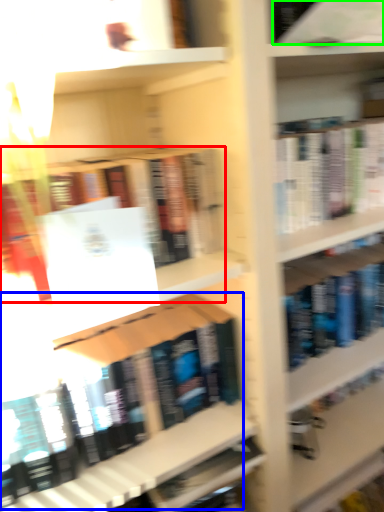
Question: Which object is the farthest from book (highlighted by a red box)? Choose among these: book (highlighted by a blue box) or book (highlighted by a green box).

Choices:
 (A) book
 (B) book

Answer: (A)